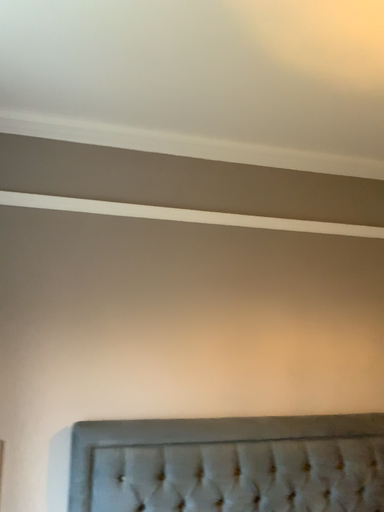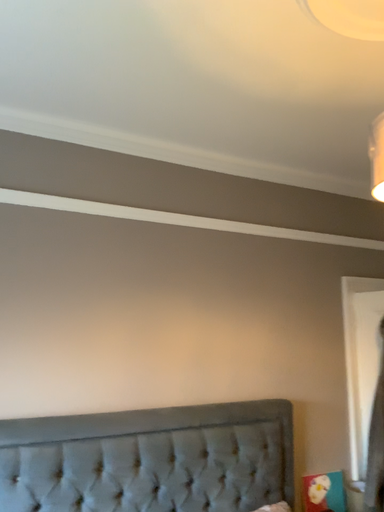
Question: Which way did the camera rotate in the video?

Choices:
 (A) rotated right
 (B) rotated left

Answer: (A)